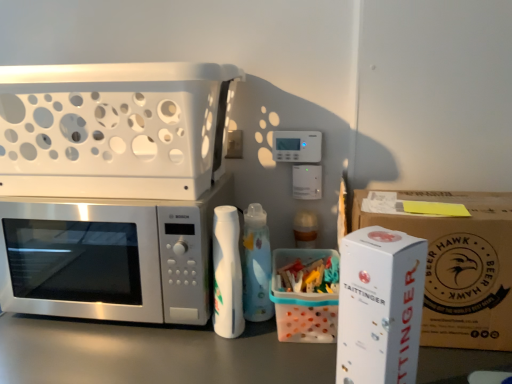
Question: Does satin silver microwave at left appear on the right side of translucent plastic container at center, which ranks as the second cardboard box in right-to-left order?

Choices:
 (A) yes
 (B) no

Answer: (B)

Question: Considering the relative sizes of satin silver microwave at left and translucent plastic container at center, which ranks as the second cardboard box in right-to-left order, in the image provided, is satin silver microwave at left shorter than translucent plastic container at center, which ranks as the second cardboard box in right-to-left order,?

Choices:
 (A) yes
 (B) no

Answer: (B)

Question: Is satin silver microwave at left wider than translucent plastic container at center, the first cardboard box positioned from the left?

Choices:
 (A) yes
 (B) no

Answer: (A)

Question: From the image's perspective, is satin silver microwave at left under translucent plastic container at center, which ranks as the second cardboard box in right-to-left order?

Choices:
 (A) no
 (B) yes

Answer: (A)

Question: Is satin silver microwave at left taller than translucent plastic container at center, which ranks as the second cardboard box in right-to-left order?

Choices:
 (A) no
 (B) yes

Answer: (B)

Question: Considering the relative positions of translucent plastic container at center, which ranks as the second cardboard box in right-to-left order, and white cardboard box at right, acting as the second cardboard box starting from the left, in the image provided, is translucent plastic container at center, which ranks as the second cardboard box in right-to-left order, to the left or to the right of white cardboard box at right, acting as the second cardboard box starting from the left,?

Choices:
 (A) right
 (B) left

Answer: (B)

Question: Which is correct: translucent plastic container at center, the first cardboard box positioned from the left, is inside white cardboard box at right, acting as the second cardboard box starting from the left, or outside of it?

Choices:
 (A) inside
 (B) outside

Answer: (B)

Question: From a real-world perspective, is translucent plastic container at center, the first cardboard box positioned from the left, above or below white cardboard box at right, acting as the second cardboard box starting from the left?

Choices:
 (A) above
 (B) below

Answer: (B)

Question: Relative to white cardboard box at right, the 1th cardboard box when ordered from right to left, is translucent plastic container at center, the first cardboard box positioned from the left, in front or behind?

Choices:
 (A) front
 (B) behind

Answer: (B)

Question: From a real-world perspective, is white plastic basket at upper left, marked as the first appliance in a left-to-right arrangement, positioned above or below white cardboard box at right, the 1th cardboard box when ordered from right to left?

Choices:
 (A) above
 (B) below

Answer: (A)

Question: Relative to white cardboard box at right, the 1th cardboard box when ordered from right to left, is white plastic basket at upper left, the second appliance when ordered from bottom to top, in front or behind?

Choices:
 (A) behind
 (B) front

Answer: (A)

Question: From their relative heights in the image, would you say white plastic basket at upper left, the first appliance when ordered from top to bottom, is taller or shorter than white cardboard box at right, the 1th cardboard box when ordered from right to left?

Choices:
 (A) short
 (B) tall

Answer: (A)

Question: Choose the correct answer: Is white plastic basket at upper left, which appears as the 2th appliance when viewed from the front, inside white cardboard box at right, acting as the second cardboard box starting from the left, or outside it?

Choices:
 (A) inside
 (B) outside

Answer: (B)

Question: From a real-world perspective, is satin silver microwave at left positioned above or below white cardboard box at right, acting as the first appliance starting from the front?

Choices:
 (A) below
 (B) above

Answer: (A)

Question: Considering their positions, is satin silver microwave at left located in front of or behind white cardboard box at right, acting as the first appliance starting from the front?

Choices:
 (A) front
 (B) behind

Answer: (B)